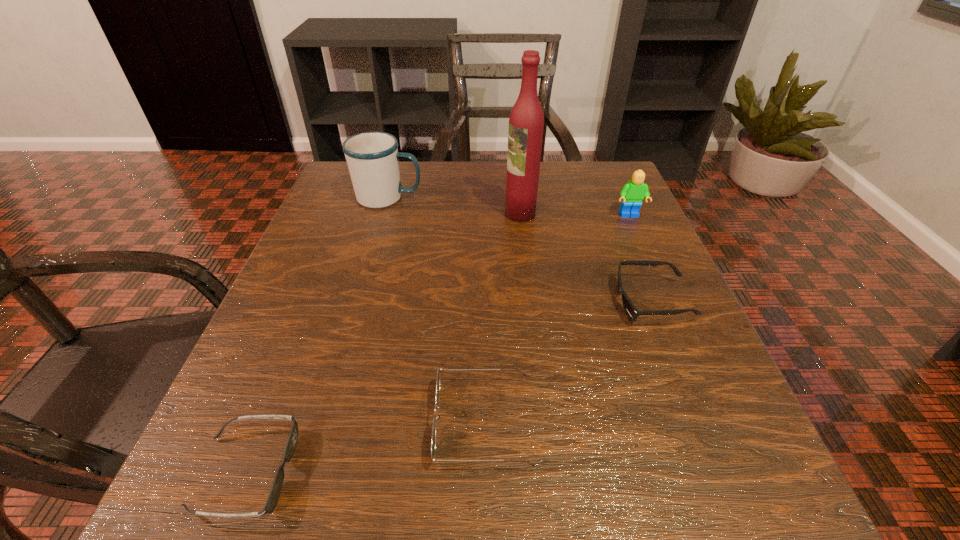
Identify the location of the tallest object. (526, 122).

This screenshot has height=540, width=960. What are the coordinates of `the fifth shortest object` in the screenshot? It's located at (372, 157).

At what (x,y) coordinates should I click in order to perform the action: click on Lego. Please return your answer as a coordinate pair (x, y). The width and height of the screenshot is (960, 540). Looking at the image, I should click on (632, 194).

What are the coordinates of `the second sunglasses from left to right` in the screenshot? It's located at (433, 441).

The image size is (960, 540). Identify the location of the farthest sunglasses. (632, 312).

Locate an element on the screen. Image resolution: width=960 pixels, height=540 pixels. the rightmost sunglasses is located at coordinates (632, 312).

At what (x,y) coordinates should I click in order to perform the action: click on the shortest object. Please return your answer as a coordinate pair (x, y). Image resolution: width=960 pixels, height=540 pixels. Looking at the image, I should click on (273, 497).

Identify the location of the leftmost sunglasses. The image size is (960, 540). (273, 497).

Identify the location of vacant region located on the label of the tallest object. (331, 214).

This screenshot has width=960, height=540. Find the location of `free spot located 0.170m on the label of the tallest object`. free spot located 0.170m on the label of the tallest object is located at coordinates (427, 214).